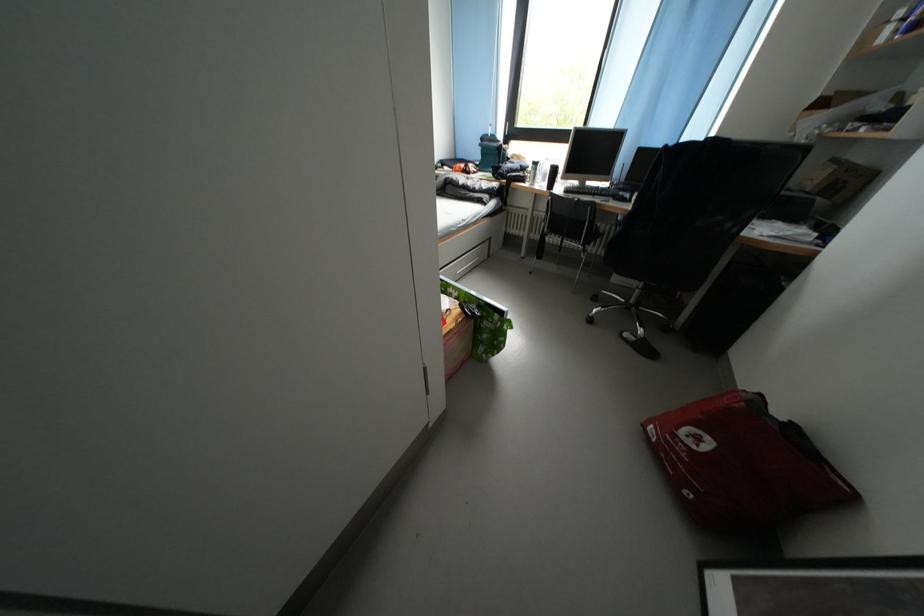
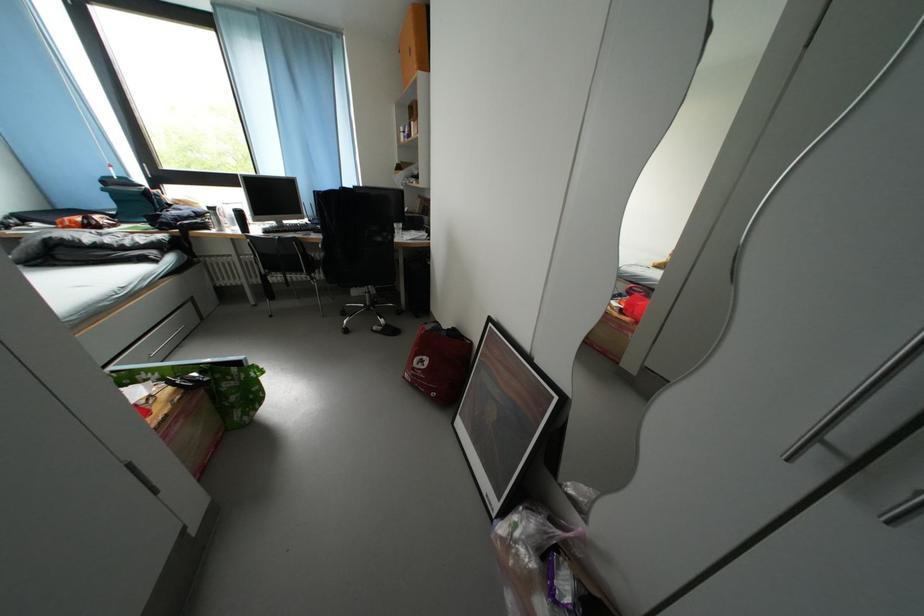
Where in the second image is the point corresponding to point (634, 339) from the first image?

(383, 333)